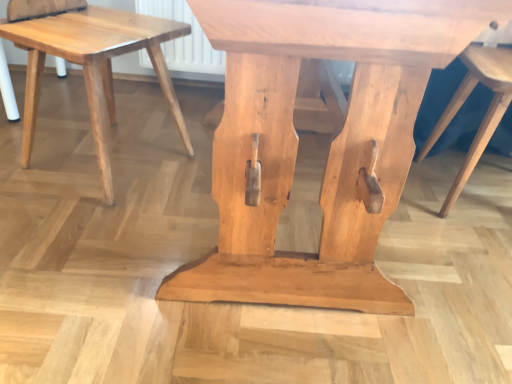
Find the location of a particular element. The image size is (512, 384). vacant location below natural wood stool at lower left, arranged as the first stool when viewed from the left (from a real-world perspective) is located at coordinates (111, 153).